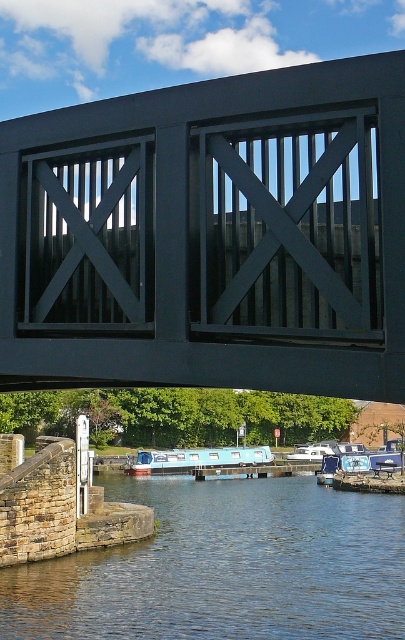
Question: Which point is closer to the camera?

Choices:
 (A) (311, 525)
 (B) (291, 129)

Answer: (B)

Question: Does smooth concrete river at lower center have a lesser width compared to light blue plastic boat at center?

Choices:
 (A) yes
 (B) no

Answer: (B)

Question: Among these objects, which one is nearest to the camera?

Choices:
 (A) light blue plastic boat at center
 (B) smooth concrete river at lower center
 (C) matte black gate at center

Answer: (C)

Question: Does smooth concrete river at lower center appear over light blue plastic boat at center?

Choices:
 (A) no
 (B) yes

Answer: (B)

Question: Does matte black gate at center appear on the left side of light blue plastic boat at center?

Choices:
 (A) yes
 (B) no

Answer: (A)

Question: Which point is farther from the camera taking this photo?

Choices:
 (A) (189, 458)
 (B) (343, 534)
 (C) (385, 141)

Answer: (A)